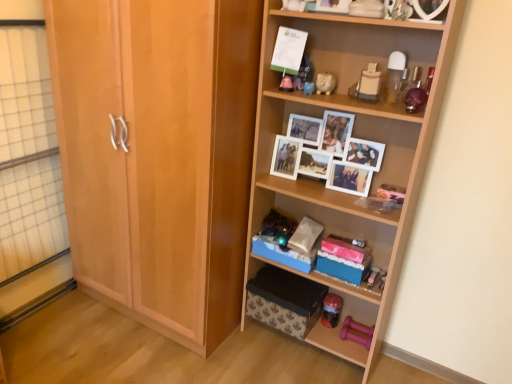
Identify the location of free space in front of transparent glass door at left. (36, 347).